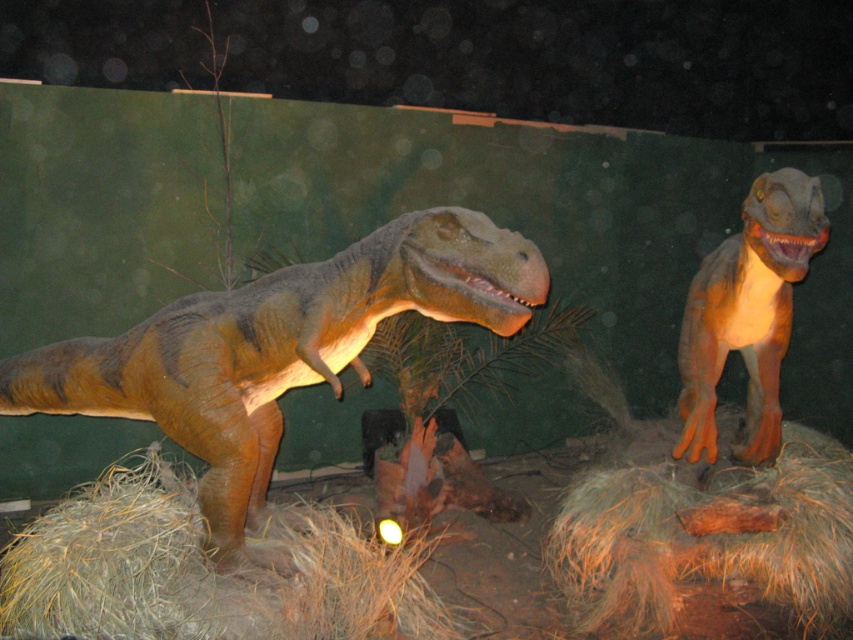
Between point (260, 500) and point (706, 390), which one is positioned in front?

Positioned in front is point (260, 500).

Measure the distance from matte brown dinosaur at left to orange matte dinosaur at right.

matte brown dinosaur at left is 1.61 meters from orange matte dinosaur at right.

Measure the distance between matte brown dinosaur at left and camera.

matte brown dinosaur at left is 8.61 feet away from camera.

I want to click on matte brown dinosaur at left, so click(277, 348).

Can you confirm if brown straw at lower left is positioned above orange matte dinosaur at right?

No, brown straw at lower left is not above orange matte dinosaur at right.

The image size is (853, 640). What do you see at coordinates (204, 570) in the screenshot? I see `brown straw at lower left` at bounding box center [204, 570].

The height and width of the screenshot is (640, 853). Describe the element at coordinates (204, 570) in the screenshot. I see `brown straw at lower left` at that location.

At what (x,y) coordinates should I click in order to perform the action: click on brown straw at lower left. Please return your answer as a coordinate pair (x, y). Looking at the image, I should click on (204, 570).

Does brown fibrous hay at right have a lesser width compared to orange matte dinosaur at right?

No.

Can you confirm if brown fibrous hay at right is smaller than orange matte dinosaur at right?

Actually, brown fibrous hay at right might be larger than orange matte dinosaur at right.

Find the location of a particular element. This screenshot has height=640, width=853. brown fibrous hay at right is located at coordinates (708, 540).